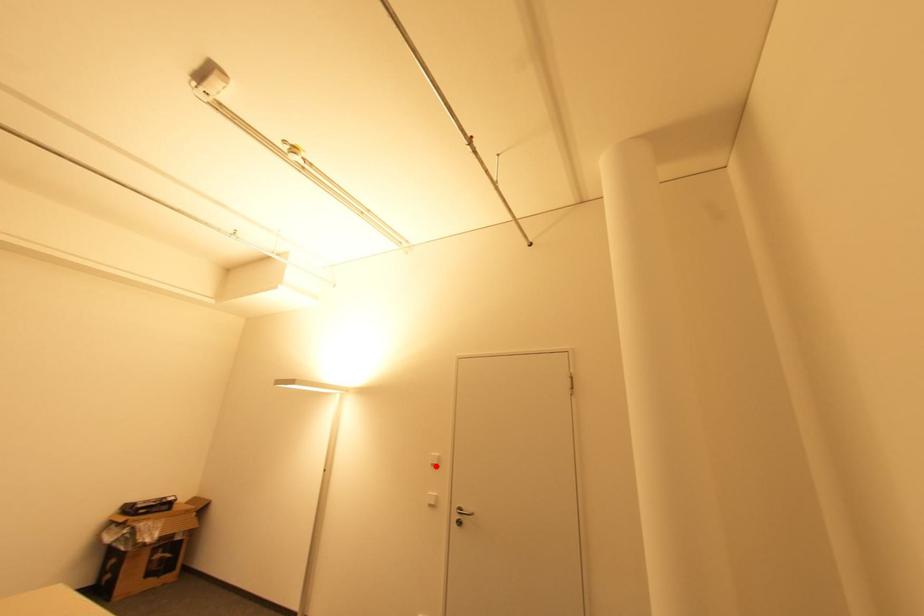
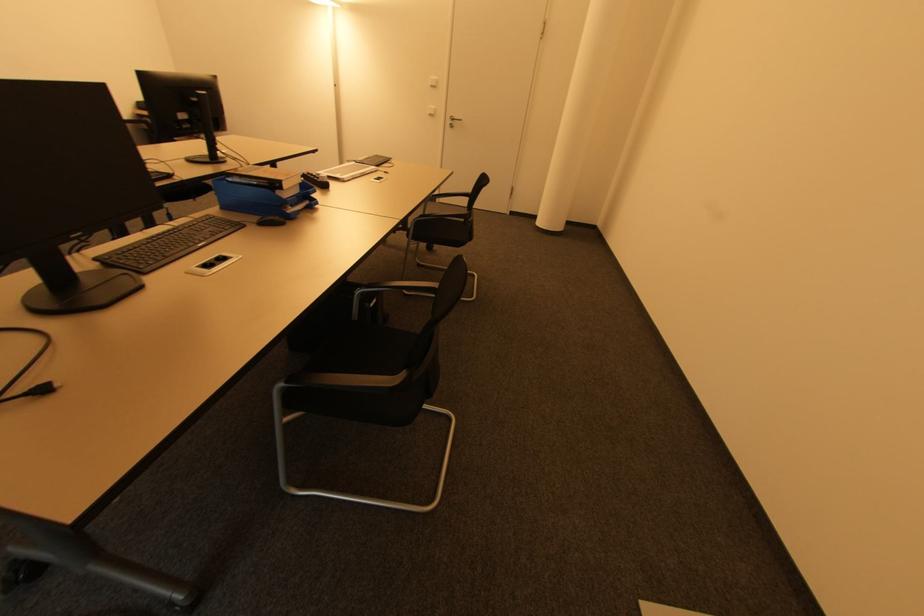
Question: I am providing you with two images of the same scene from different viewpoints. Image1 has a red point marked. In image2, the corresponding 3D location appears at what relative position? Reply with the corresponding letter.

Choices:
 (A) Closer
 (B) Farther

Answer: (A)